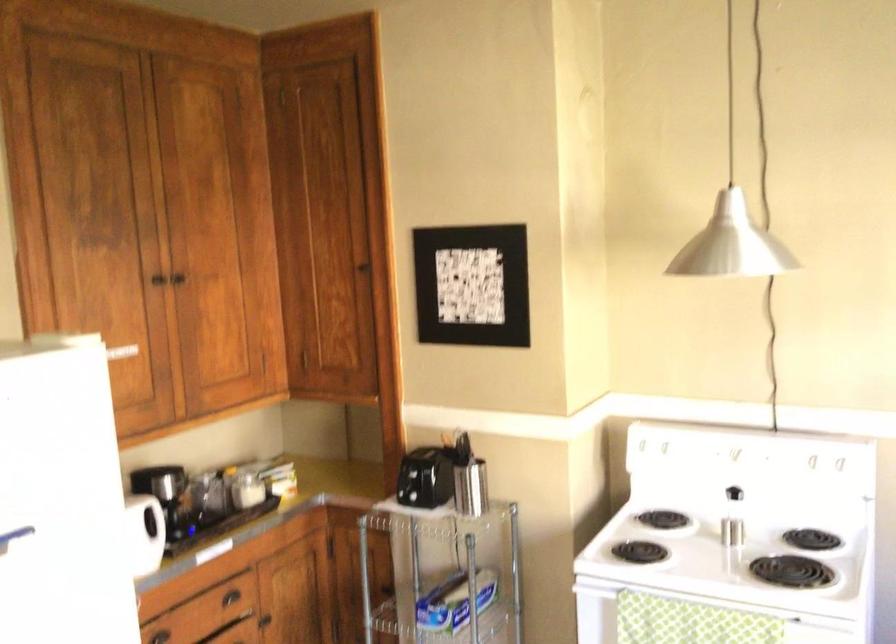
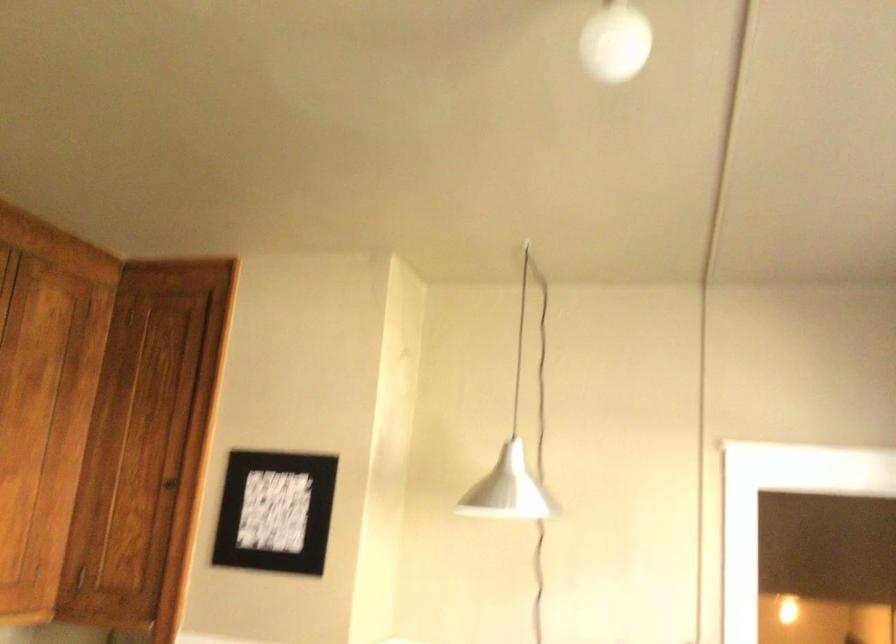
In the second image, find the point that corresponds to point 463,287 in the first image.

(274, 512)